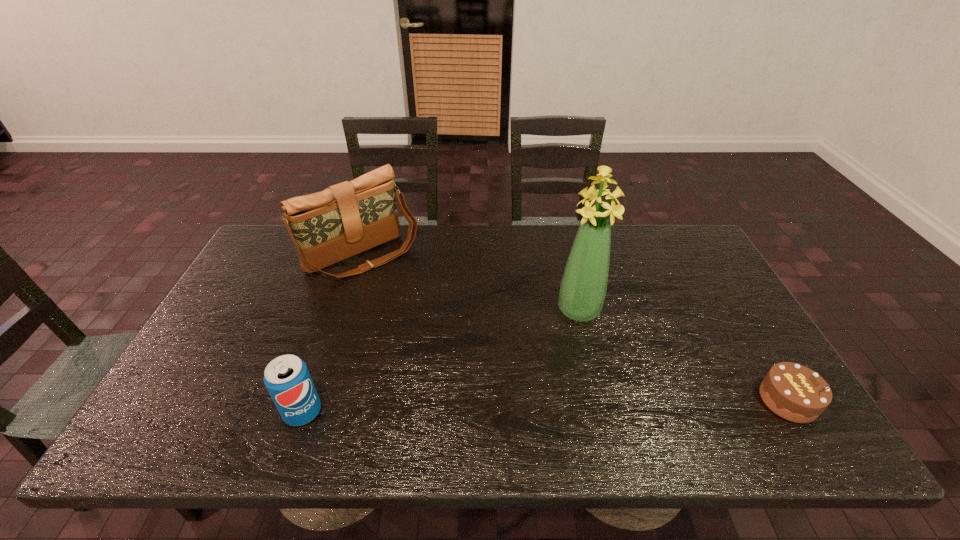
The image size is (960, 540). Identify the location of vacant spot on the desktop that is between the soda can and the chocolate cake and is positioned on the front-facing side of the bouquet. (573, 405).

Image resolution: width=960 pixels, height=540 pixels. I want to click on vacant space on the desktop that is between the second shortest object and the chocolate cake and is positioned on the front-facing side of the farthest object, so click(506, 407).